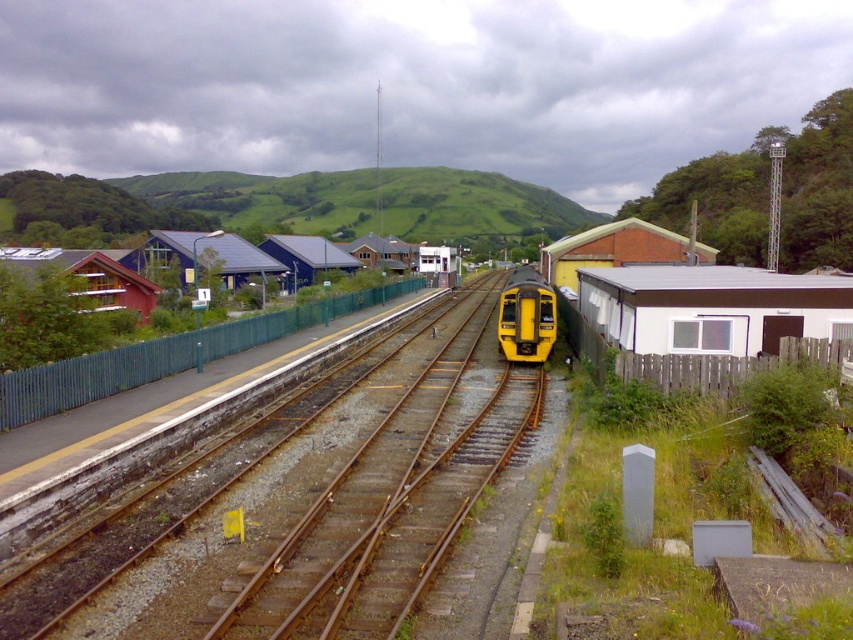
Looking at this image, you are a maintenance worker standing on the platform. You need to walk to the metal tracks at center to inspect them. The yellow matte train at center is approaching. If the train is moving at 10 km per hour, how many seconds do you have before it reaches your current position?

The metal tracks at center is 9.52 meters from yellow matte train at center. To calculate the time, first convert 10 km per hour to meters per second, which is approximately 2.78 mps. Then divide the distance by speed to get 9.52 meters divided by 2.78 mps equals approximately 3.43 seconds. Therefore, you have about 3 seconds before the train reaches your current position.